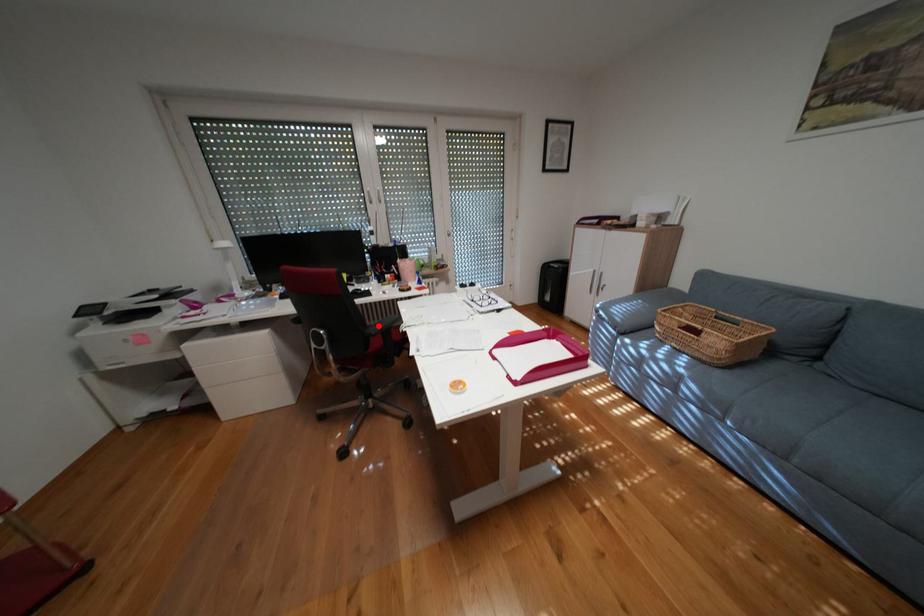
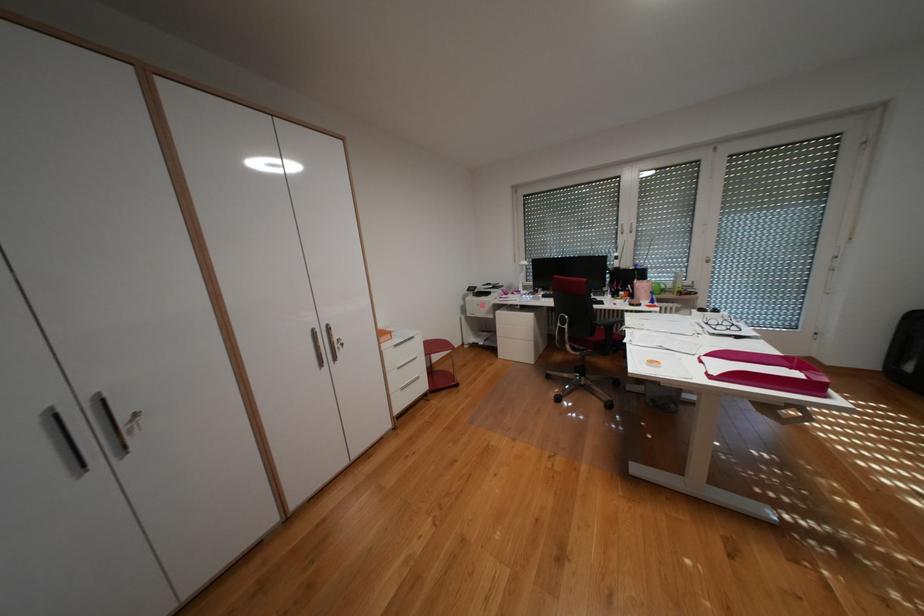
The point at the highlighted location is marked in the first image. Where is the corresponding point in the second image?

(608, 318)